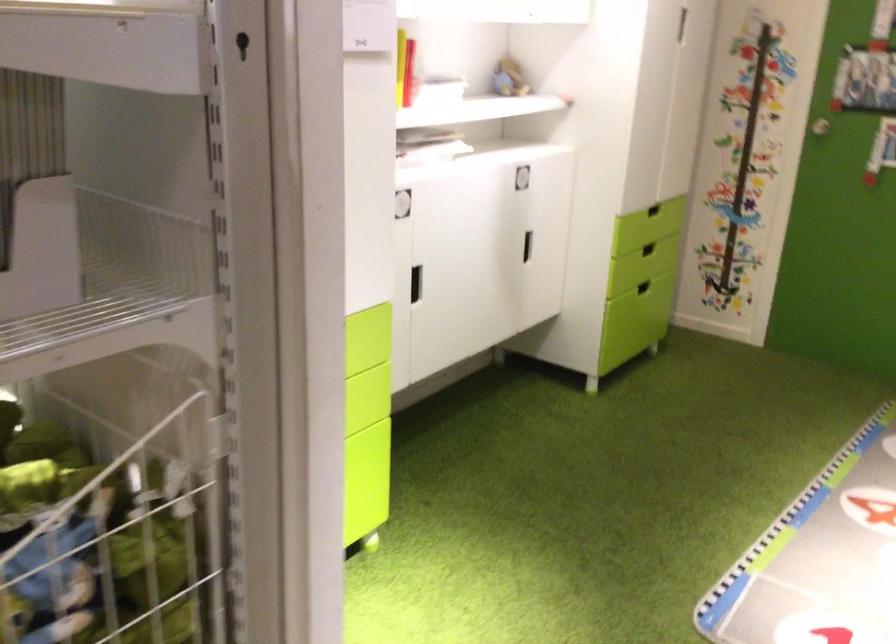
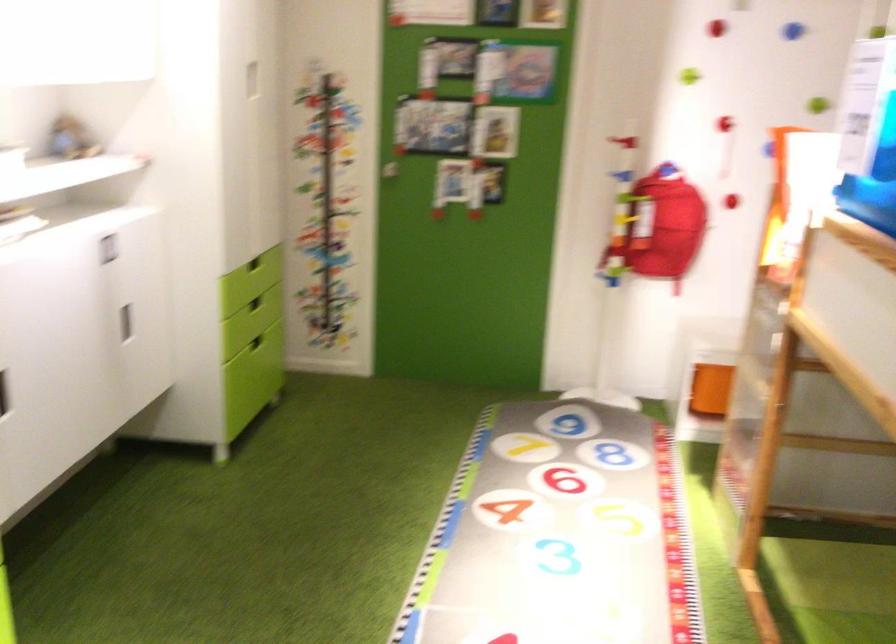
In the second image, find the point that corresponds to the point at 657,205 in the first image.

(254, 263)